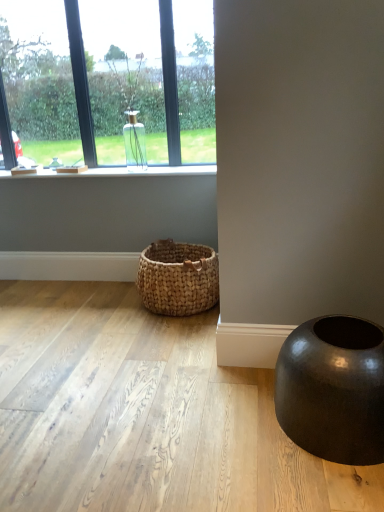
You are a GUI agent. You are given a task and a screenshot of the screen. Output one action in this format:
    pyautogui.click(x=<x>, y=<y>)
    Task: Click on the vacant space positioned to the left of shiny black vase at lower right
    The image size is (384, 512).
    Given the screenshot: What is the action you would take?
    pyautogui.click(x=216, y=419)